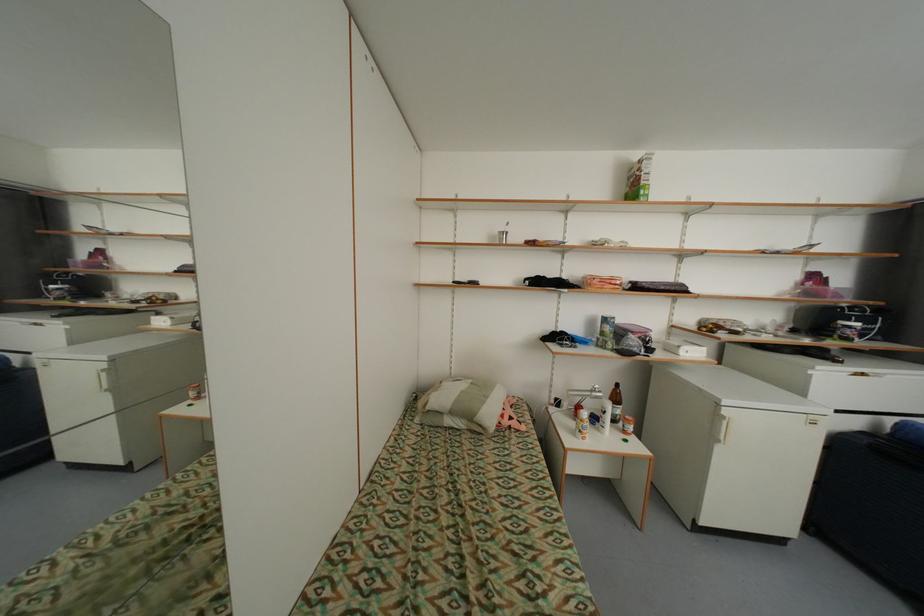
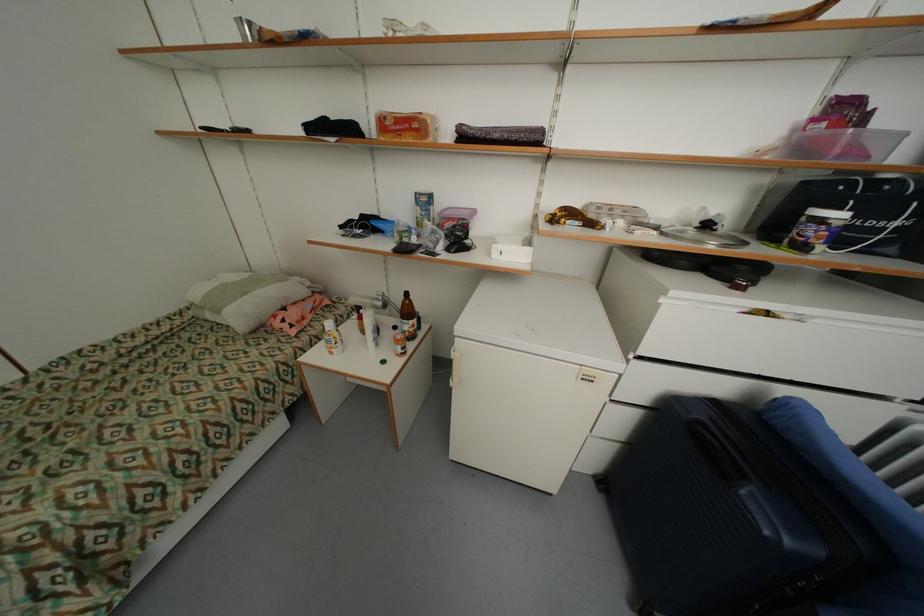
Find the pixel in the second image that matches the point at 857,333 in the first image.

(819, 233)